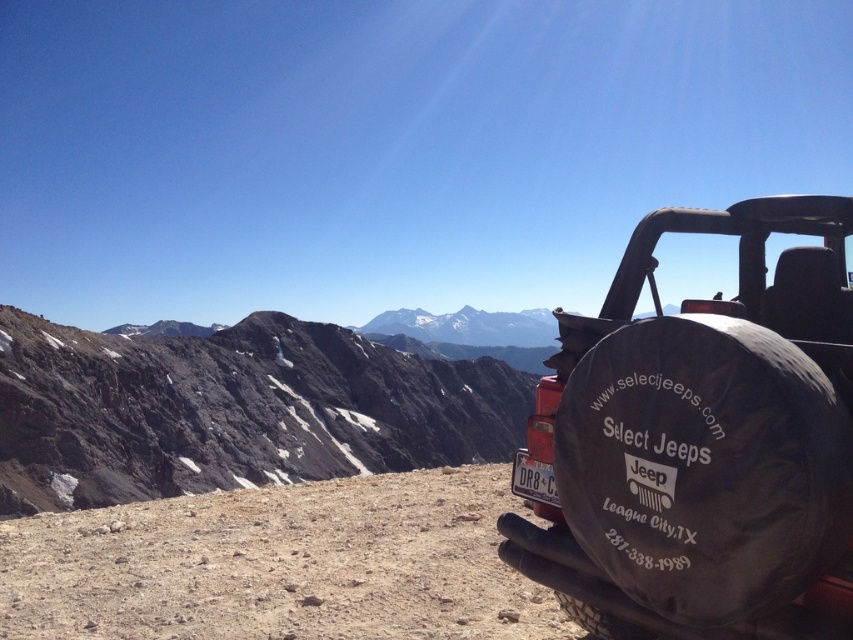
You are a hiker who wants to reach the rugged stone mountain at center from the black rubber tire at right. Based on the distance provided, can you estimate how long it would take you to walk there at a moderate pace of 3 miles per hour?

The distance between the black rubber tire at right and rugged stone mountain at center is 126.53 meters. Converting meters to miles, 126.53 meters is approximately 0.0786 miles. At a moderate pace of 3 miles per hour, it would take roughly 1.57 minutes to walk this distance.

You are a photographer planning to capture the rugged stone mountain at center and the white plastic license plate at center in a single frame. Considering their sizes, which object will appear larger in the photo?

The rugged stone mountain at center will appear larger in the photo because it is much taller than the white plastic license plate at center.

You are a photographer planning to take a wide shot of the rugged stone mountain at center and the black rubber tire at right. Which object will appear narrower in the photo?

The black rubber tire at right will appear narrower in the photo because it is thinner than the rugged stone mountain at center.